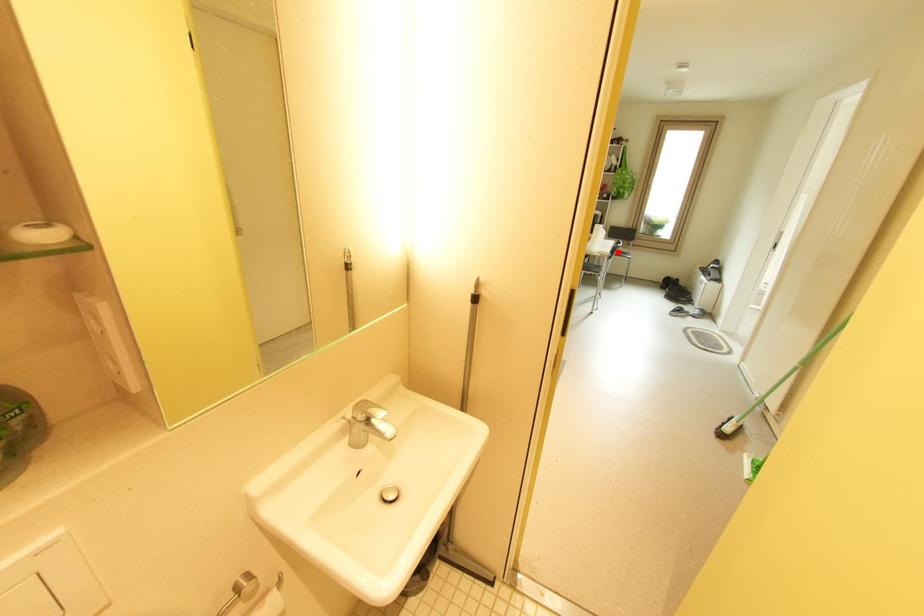
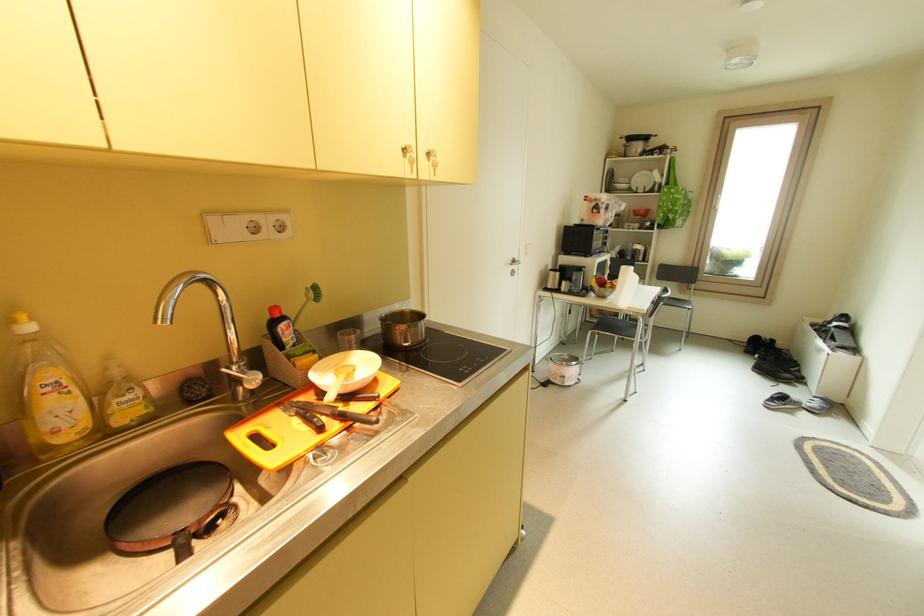
The point at the highlighted location is marked in the first image. Where is the corresponding point in the second image?

(662, 304)